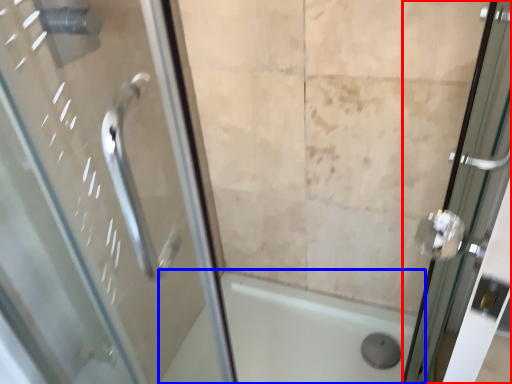
Question: Which object appears closest to the camera in this image, door (highlighted by a red box) or bath (highlighted by a blue box)?

Choices:
 (A) door
 (B) bath

Answer: (A)